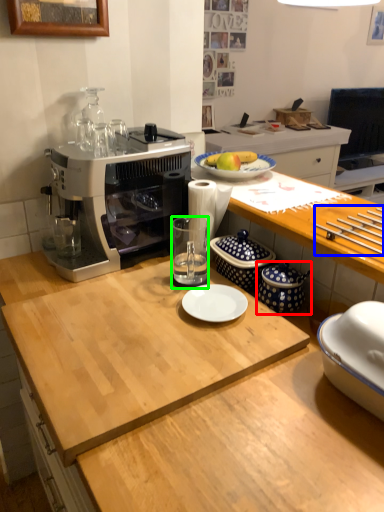
Question: Estimate the real-world distances between objects in this image. Which object is farther from appliance (highlighted by a red box), tableware (highlighted by a blue box) or tableware (highlighted by a green box)?

Choices:
 (A) tableware
 (B) tableware

Answer: (B)